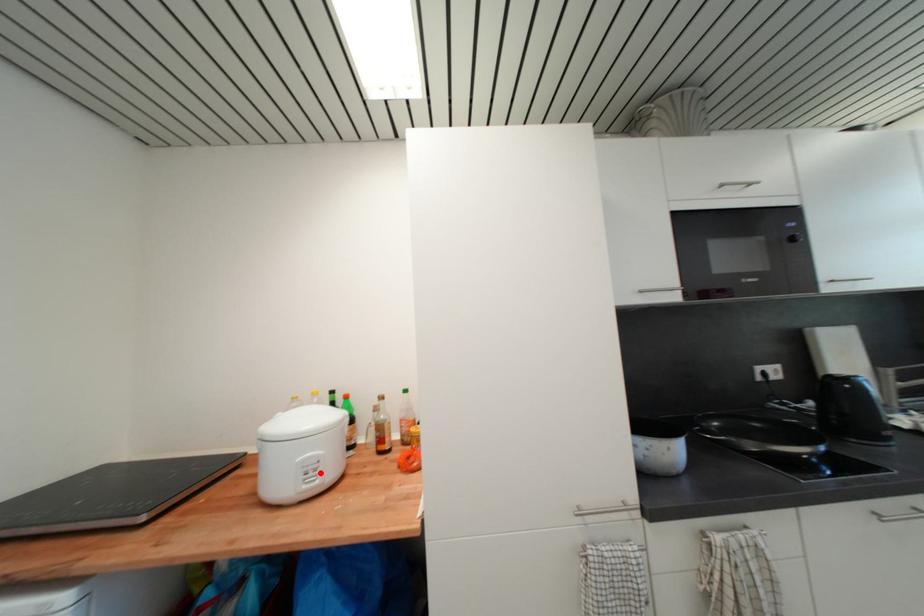
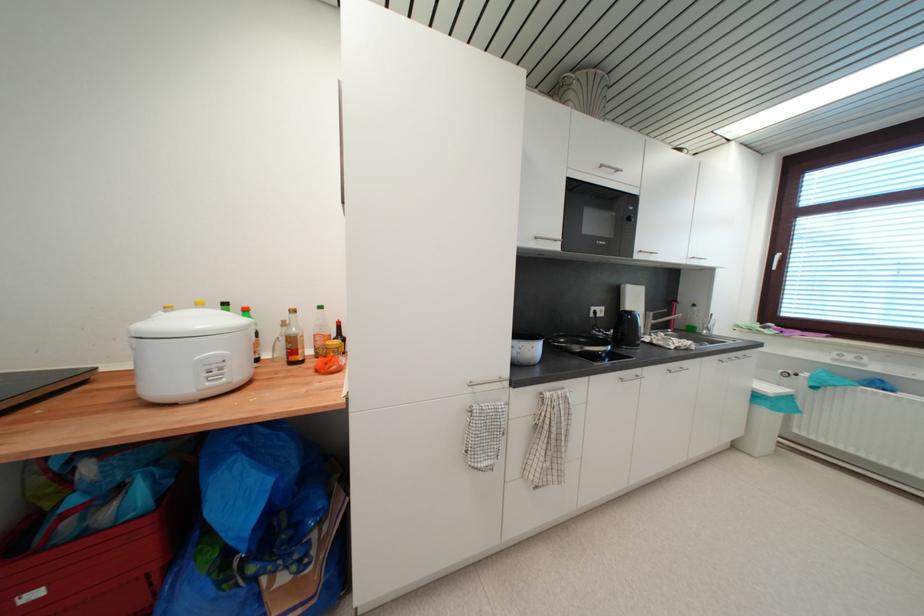
Question: I am providing you with two images of the same scene from different viewpoints. A red point is marked on the first image. At the location where the point appears in image 1, is it still visible in image 2?

Choices:
 (A) Yes
 (B) No

Answer: (A)